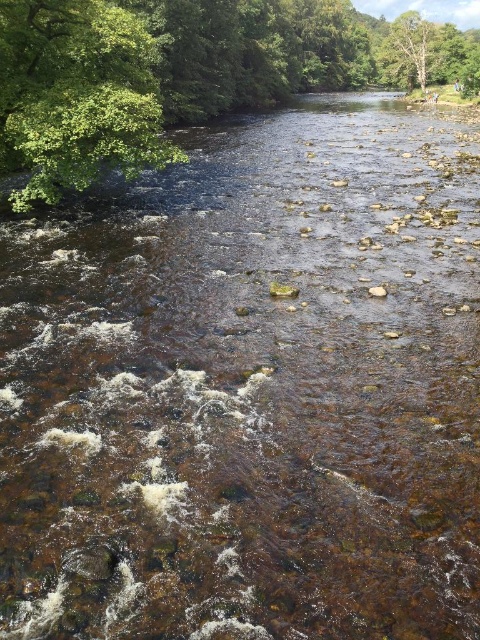
Question: Is green leafy tree at upper left bigger than green leafy tree at upper right?

Choices:
 (A) no
 (B) yes

Answer: (B)

Question: Which is farther from the green leafy tree at upper left?

Choices:
 (A) green leafy tree at upper right
 (B) green leafy tree at left
 (C) brown smooth rock at center

Answer: (C)

Question: Is green leafy tree at left to the right of brown smooth rock at center from the viewer's perspective?

Choices:
 (A) yes
 (B) no

Answer: (B)

Question: Which of these objects is positioned closest to the green leafy tree at upper left?

Choices:
 (A) green leafy tree at upper right
 (B) green leafy tree at left

Answer: (B)

Question: Is green leafy tree at upper right below brown smooth rock at center?

Choices:
 (A) no
 (B) yes

Answer: (A)

Question: Among these points, which one is nearest to the camera?

Choices:
 (A) (431, 44)
 (B) (139, 44)
 (C) (307, 6)
 (D) (375, 289)

Answer: (D)